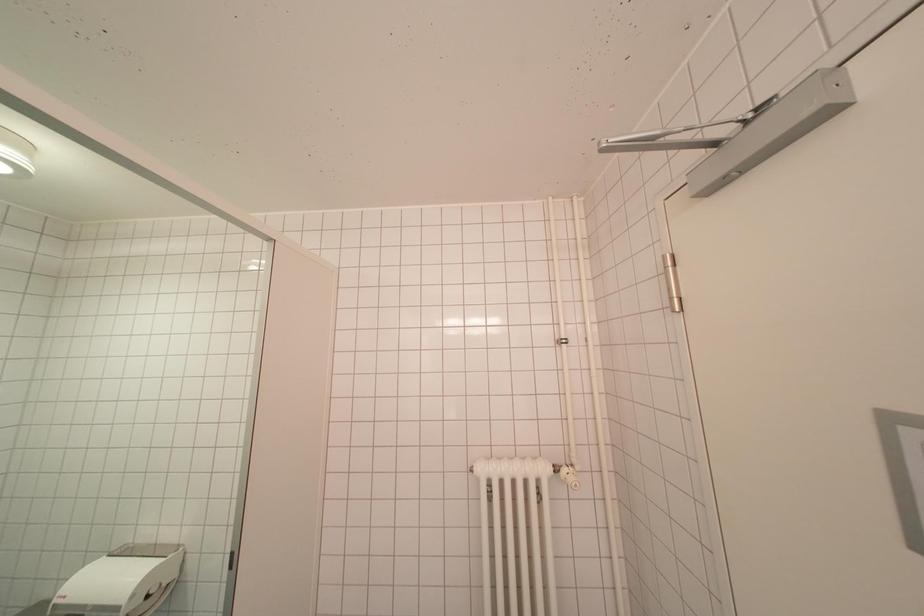
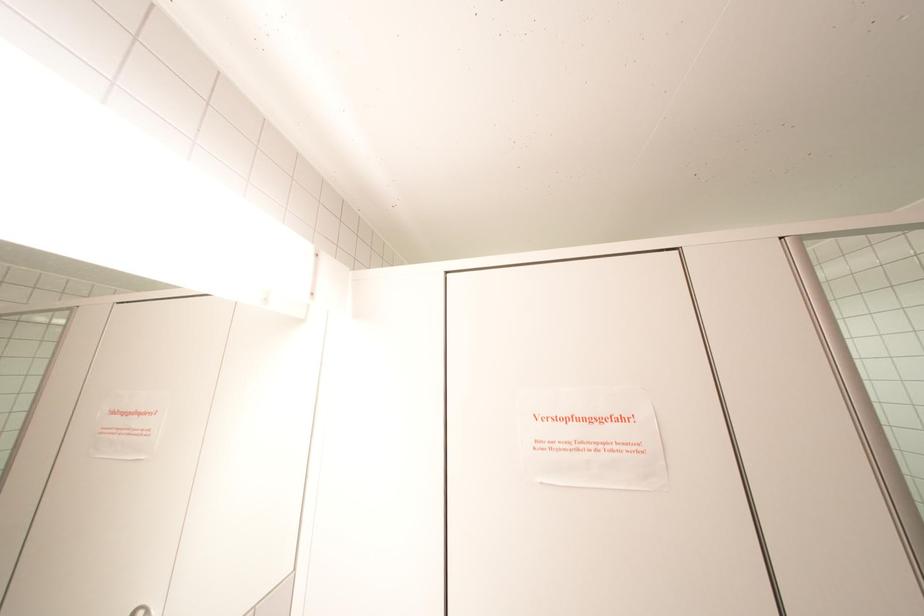
Based on the photo, based on the continuous images, in which direction is the camera rotating?

The rotation direction of the camera is left-up.